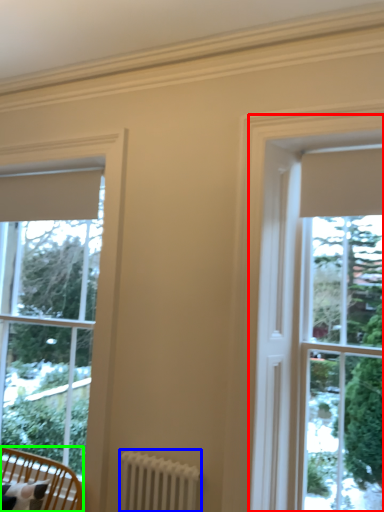
Question: Which object is positioned closest to bay window (highlighted by a red box)? Select from radiator (highlighted by a blue box) and furniture (highlighted by a green box).

Choices:
 (A) radiator
 (B) furniture

Answer: (A)